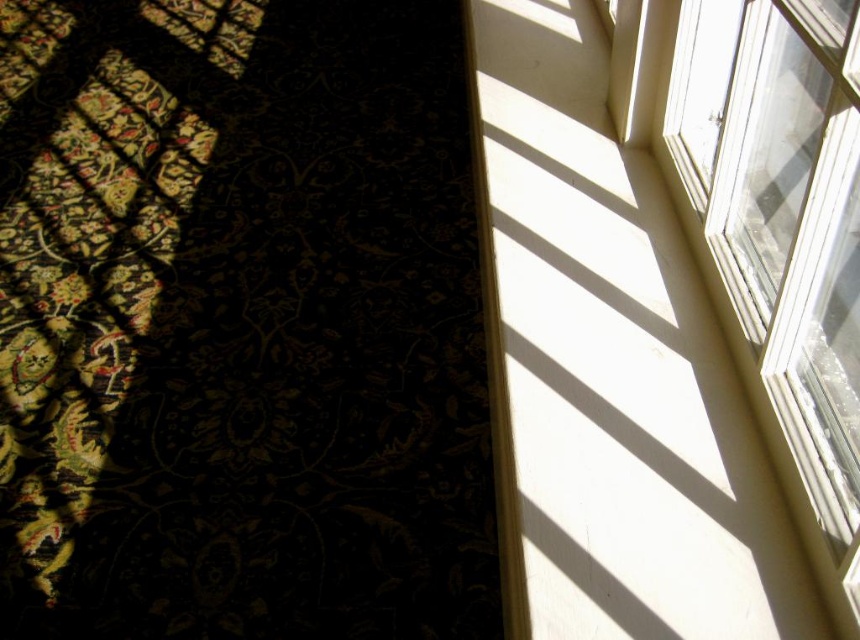
Does dark floral carpet at lower left appear under clear glass window at upper right?

Incorrect, dark floral carpet at lower left is not positioned below clear glass window at upper right.

Describe the element at coordinates (121, 296) in the screenshot. This screenshot has width=860, height=640. I see `dark floral carpet at lower left` at that location.

Does point (186, 161) lie in front of point (759, 24)?

No.

Identify the location of dark floral carpet at lower left. The height and width of the screenshot is (640, 860). (121, 296).